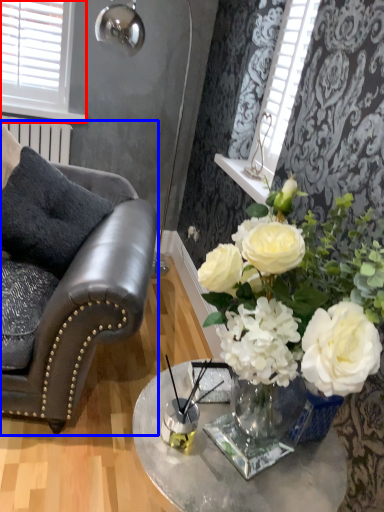
Question: Which point is further to the camera, window (highlighted by a red box) or chair (highlighted by a blue box)?

Choices:
 (A) window
 (B) chair

Answer: (A)